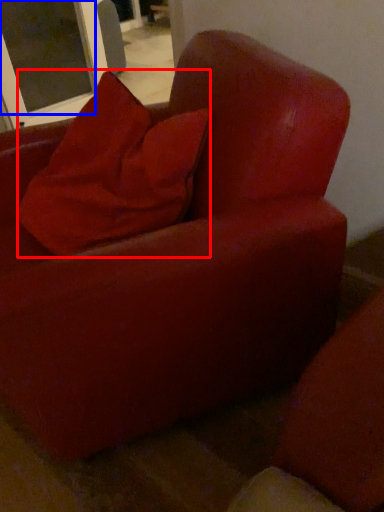
Question: Which point is further to the camera, pillow (highlighted by a red box) or screen door (highlighted by a blue box)?

Choices:
 (A) pillow
 (B) screen door

Answer: (B)